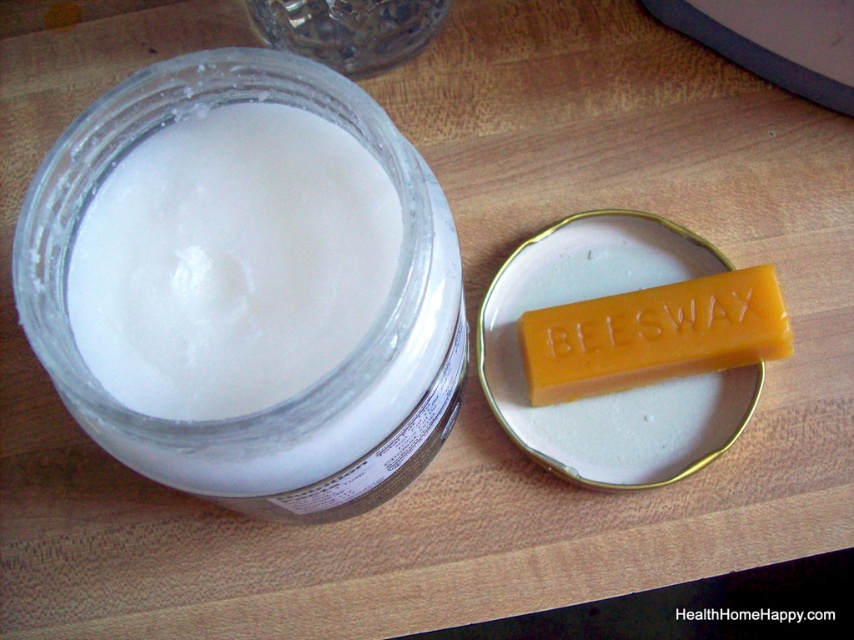
Which is behind, point (135, 337) or point (282, 13)?

Positioned behind is point (282, 13).

Which of these two, white matte jar at center or transparent glass jar at upper center, stands taller?

Standing taller between the two is white matte jar at center.

Is point (143, 364) behind point (423, 26)?

That is False.

The height and width of the screenshot is (640, 854). I want to click on white matte jar at center, so click(232, 262).

Who is more distant from viewer, (390, 204) or (714, 312)?

Point (714, 312)

Between white matte jar at center and yellow beeswax bar at center, which one has less height?

yellow beeswax bar at center

Which is in front, point (196, 260) or point (665, 296)?

Point (196, 260)

Find the location of a particular element. white matte jar at center is located at coordinates (232, 262).

What do you see at coordinates (653, 336) in the screenshot? The image size is (854, 640). I see `yellow beeswax bar at center` at bounding box center [653, 336].

Is yellow beeswax bar at center below transparent glass jar at upper center?

Yes.

At what (x,y) coordinates should I click in order to perform the action: click on yellow beeswax bar at center. Please return your answer as a coordinate pair (x, y). Looking at the image, I should click on point(653,336).

Locate an element on the screen. This screenshot has height=640, width=854. yellow beeswax bar at center is located at coordinates (653, 336).